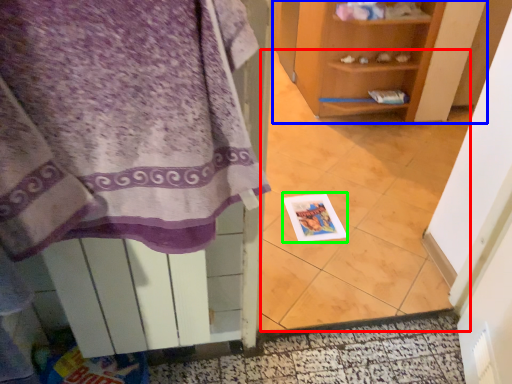
Question: Estimate the real-world distances between objects in this image. Which object is farther from tile (highlighted by a red box), shelf (highlighted by a blue box) or postcard (highlighted by a green box)?

Choices:
 (A) shelf
 (B) postcard

Answer: (A)